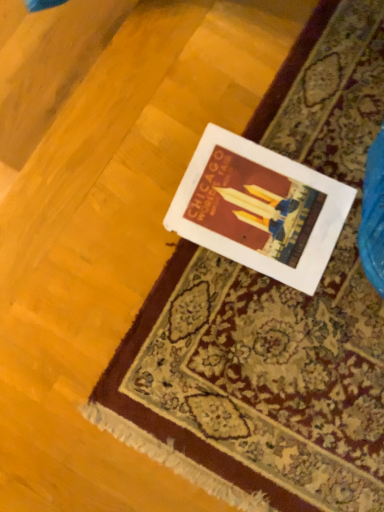
The width and height of the screenshot is (384, 512). In order to click on vacant location below matte paper book at center (from a real-world perspective) in this screenshot , I will do `click(255, 208)`.